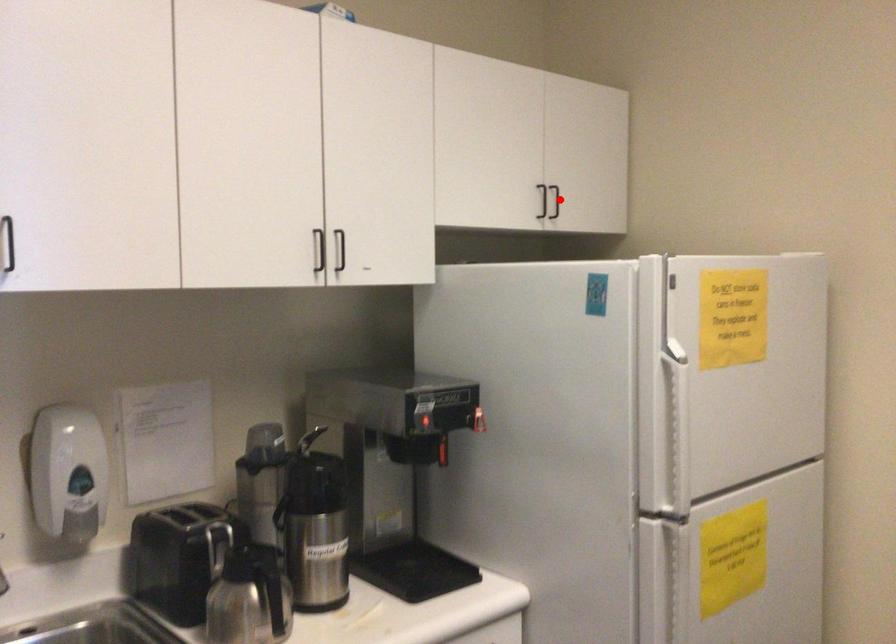
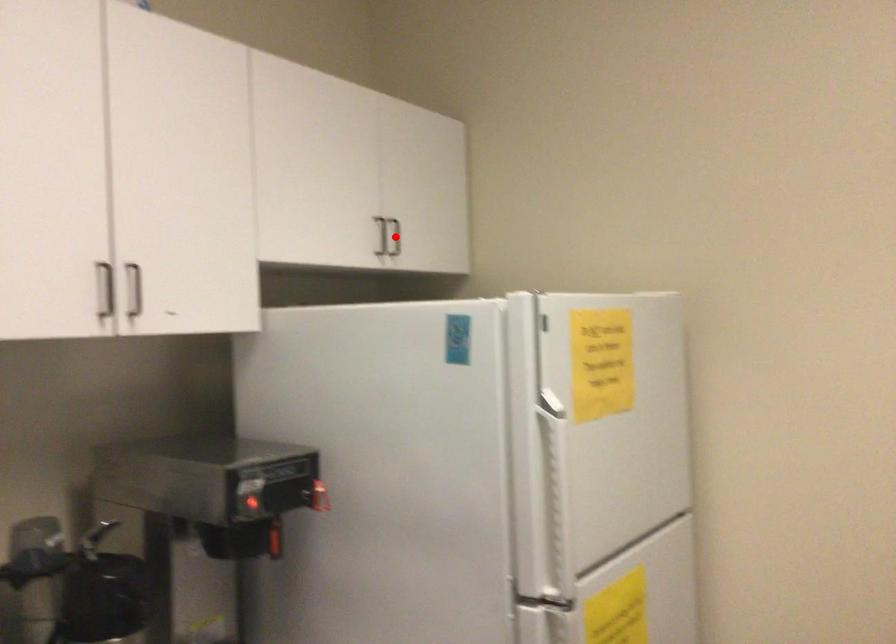
I am providing you with two images of the same scene from different viewpoints. A red point is marked on the first image and another point is marked on the second image. Do the highlighted points in image1 and image2 indicate the same real-world spot?

Yes